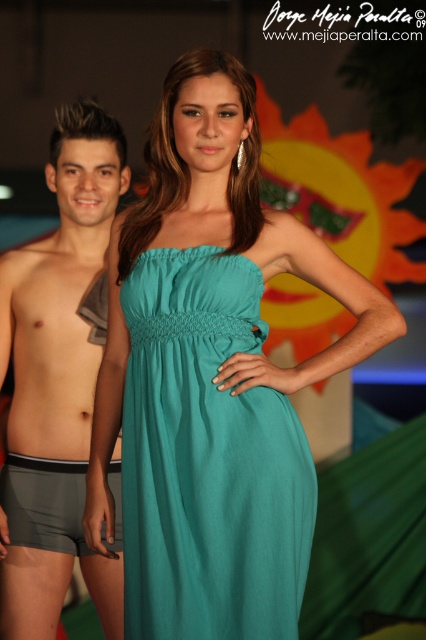
You are a photographer setting up a shoot in a tropical setting. You have two subjects wearing the teal fabric dress at center and the skinny gray shorts at left. Based on their clothing, which subject should you position closer to the foreground to ensure both appear proportionate in the frame?

The teal fabric dress at center is much taller than the skinny gray shorts at left, so positioning the subject in the teal fabric dress at center slightly further back will help balance their sizes in the photo, making them appear proportionate.